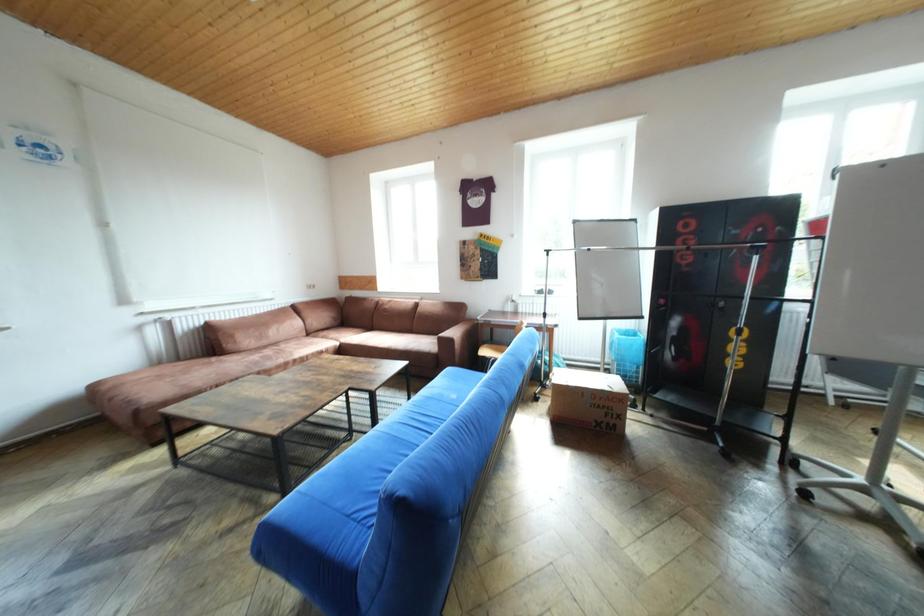
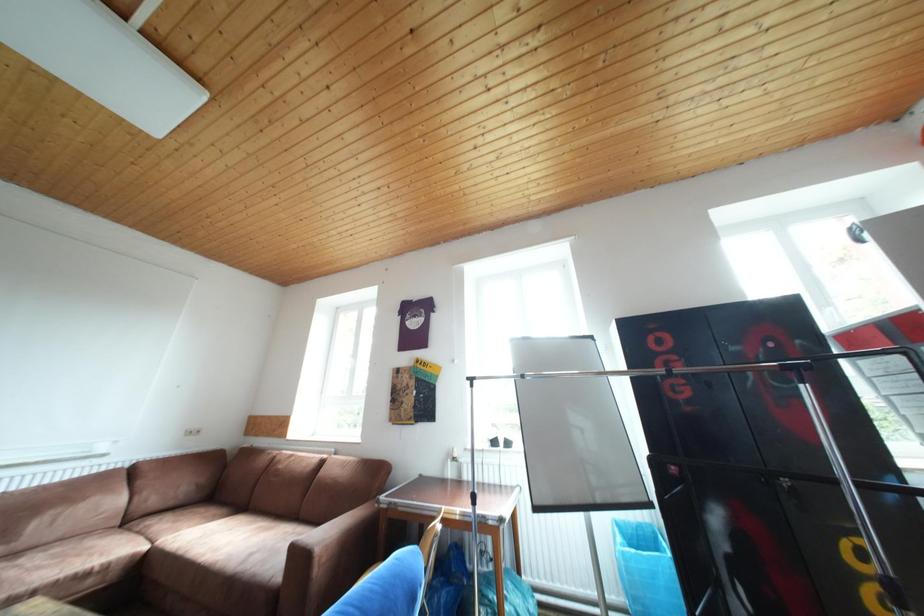
Which direction would the cameraman need to move to produce the second image?

The cameraman walked toward right, forward.